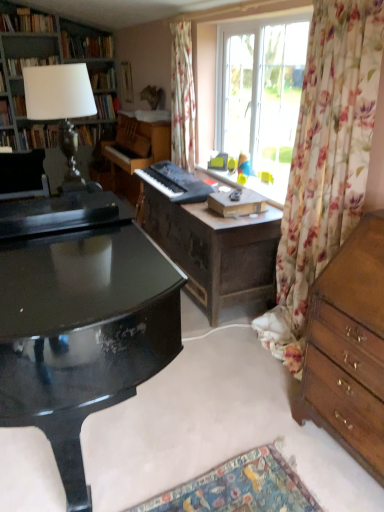
Identify the location of free space to the left of floral fabric curtain at right, placed as the 2th curtain when sorted from left to right. (230, 347).